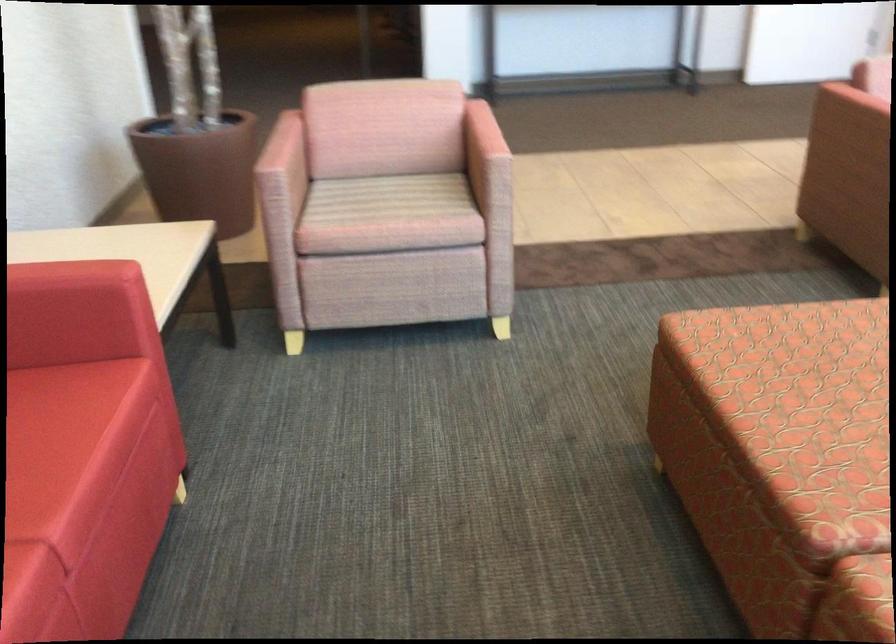
Where would you sit the patterned sofa sitting surface? Please return your answer as a coordinate pair (x, y).

(782, 350)